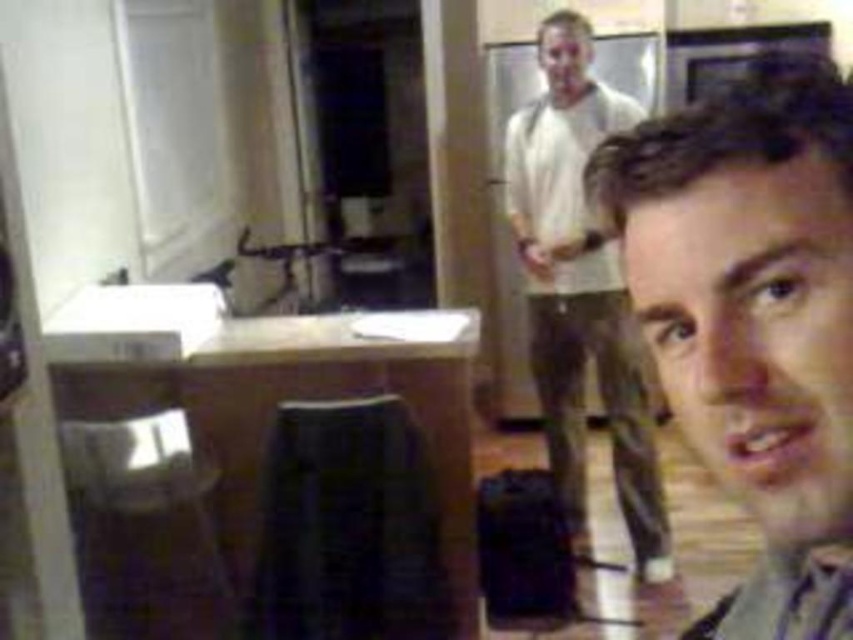
Is light brown hair at center above white cotton shirt at upper center?

No.

Does light brown hair at center have a greater width compared to white cotton shirt at upper center?

No.

The image size is (853, 640). What are the coordinates of `light brown hair at center` in the screenshot? It's located at (753, 317).

Which is behind, point (577, 236) or point (196, 531)?

The point (577, 236) is behind.

Can you confirm if white cotton shirt at upper center is positioned to the left of metallic silver stool at lower left?

In fact, white cotton shirt at upper center is to the right of metallic silver stool at lower left.

Locate an element on the screen. white cotton shirt at upper center is located at coordinates (579, 289).

Between light brown hair at center and metallic silver stool at lower left, which one is positioned lower?

metallic silver stool at lower left is lower down.

Which is above, light brown hair at center or metallic silver stool at lower left?

Positioned higher is light brown hair at center.

Between point (827, 260) and point (122, 592), which one is positioned behind?

The point (122, 592) is behind.

Locate an element on the screen. light brown hair at center is located at coordinates (753, 317).